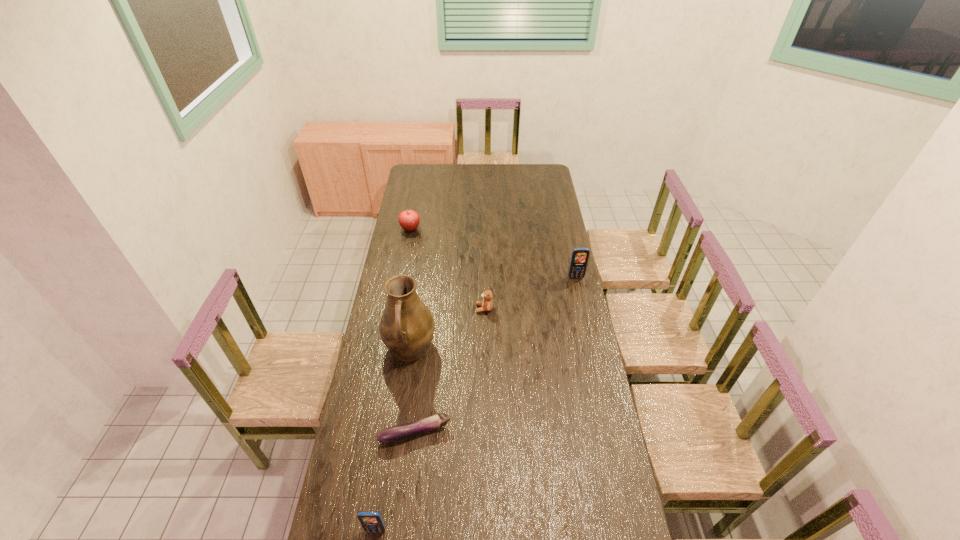
If equal spacing is desired by inserting an extra cellular_telephone among them, please point out a free spot for this new cellular_telephone. Please provide its 2D coordinates. Your answer should be formatted as a tuple, i.e. [(x, y)], where the tuple contains the x and y coordinates of a point satisfying the conditions above.

[(499, 375)]